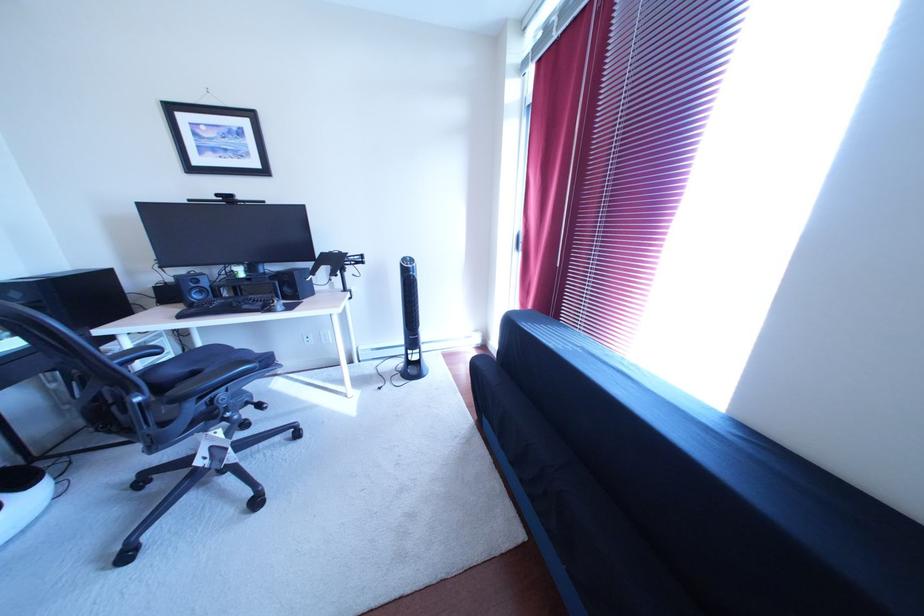
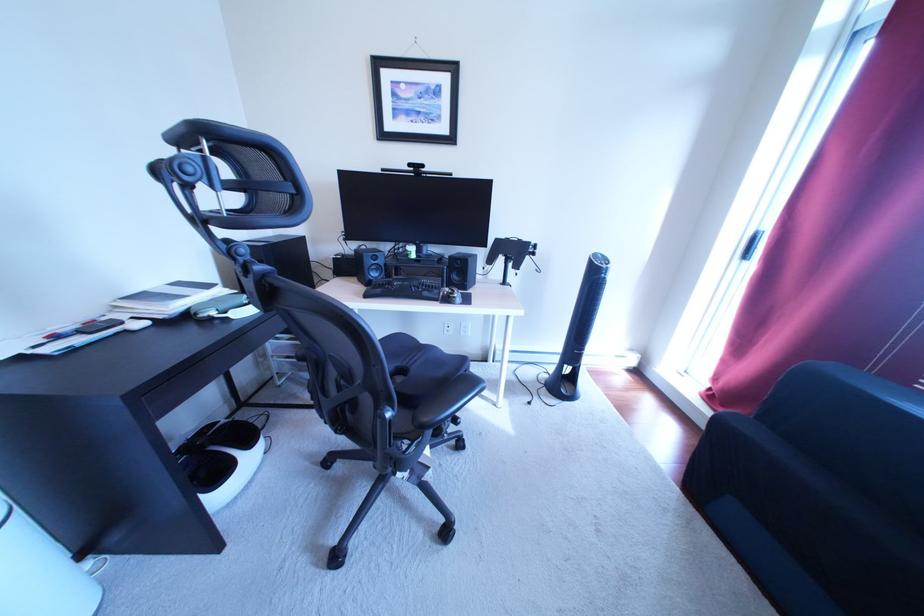
Question: What movement of the cameraman would produce the second image?

Choices:
 (A) Left
 (B) Right
 (C) Forward
 (D) Backward

Answer: (A)